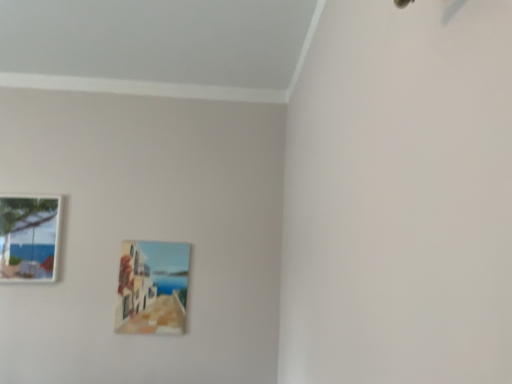
The image size is (512, 384). What do you see at coordinates (152, 287) in the screenshot?
I see `matte wooden picture frame at center, marked as the first picture frame in a right-to-left arrangement` at bounding box center [152, 287].

Measure the distance between matte wooden picture frame at center, marked as the first picture frame in a right-to-left arrangement, and camera.

The depth of matte wooden picture frame at center, marked as the first picture frame in a right-to-left arrangement, is 8.44 feet.

Measure the distance between point (142, 265) and camera.

2.62 meters.

In order to click on matte wooden picture frame at center, marked as the first picture frame in a right-to-left arrangement in this screenshot , I will do `click(152, 287)`.

Describe the element at coordinates (29, 237) in the screenshot. Image resolution: width=512 pixels, height=384 pixels. I see `wooden picture frame at lower left, the 1th picture frame when ordered from left to right` at that location.

How much space does wooden picture frame at lower left, the second picture frame when ordered from right to left, occupy vertically?

wooden picture frame at lower left, the second picture frame when ordered from right to left, is 21.69 inches in height.

Where is `wooden picture frame at lower left, the 1th picture frame when ordered from left to right`? The width and height of the screenshot is (512, 384). wooden picture frame at lower left, the 1th picture frame when ordered from left to right is located at coordinates (29, 237).

Locate an element on the screen. The height and width of the screenshot is (384, 512). matte wooden picture frame at center, which is the 2th picture frame from left to right is located at coordinates (152, 287).

Considering the relative positions of matte wooden picture frame at center, marked as the first picture frame in a right-to-left arrangement, and wooden picture frame at lower left, the 1th picture frame when ordered from left to right, in the image provided, is matte wooden picture frame at center, marked as the first picture frame in a right-to-left arrangement, to the right of wooden picture frame at lower left, the 1th picture frame when ordered from left to right, from the viewer's perspective?

Indeed, matte wooden picture frame at center, marked as the first picture frame in a right-to-left arrangement, is positioned on the right side of wooden picture frame at lower left, the 1th picture frame when ordered from left to right.

Based on the photo, considering the positions of objects matte wooden picture frame at center, which is the 2th picture frame from left to right, and wooden picture frame at lower left, the second picture frame when ordered from right to left, in the image provided, who is behind, matte wooden picture frame at center, which is the 2th picture frame from left to right, or wooden picture frame at lower left, the second picture frame when ordered from right to left,?

matte wooden picture frame at center, which is the 2th picture frame from left to right, is further from the camera.

Is point (158, 264) closer to viewer compared to point (3, 224)?

No, (158, 264) is behind (3, 224).

From the image's perspective, which object appears higher, matte wooden picture frame at center, which is the 2th picture frame from left to right, or wooden picture frame at lower left, the 1th picture frame when ordered from left to right?

From the image's view, wooden picture frame at lower left, the 1th picture frame when ordered from left to right, is above.

From a real-world perspective, does matte wooden picture frame at center, which is the 2th picture frame from left to right, sit lower than wooden picture frame at lower left, the 1th picture frame when ordered from left to right?

Yes, from a real-world perspective, matte wooden picture frame at center, which is the 2th picture frame from left to right, is below wooden picture frame at lower left, the 1th picture frame when ordered from left to right.

Based on the photo, is matte wooden picture frame at center, which is the 2th picture frame from left to right, wider or thinner than wooden picture frame at lower left, the second picture frame when ordered from right to left?

Considering their sizes, matte wooden picture frame at center, which is the 2th picture frame from left to right, looks slimmer than wooden picture frame at lower left, the second picture frame when ordered from right to left.

Considering the sizes of objects matte wooden picture frame at center, marked as the first picture frame in a right-to-left arrangement, and wooden picture frame at lower left, the second picture frame when ordered from right to left, in the image provided, who is shorter, matte wooden picture frame at center, marked as the first picture frame in a right-to-left arrangement, or wooden picture frame at lower left, the second picture frame when ordered from right to left,?

wooden picture frame at lower left, the second picture frame when ordered from right to left, is shorter.

From the picture: Considering the relative sizes of matte wooden picture frame at center, marked as the first picture frame in a right-to-left arrangement, and wooden picture frame at lower left, the second picture frame when ordered from right to left, in the image provided, is matte wooden picture frame at center, marked as the first picture frame in a right-to-left arrangement, bigger than wooden picture frame at lower left, the second picture frame when ordered from right to left,?

No, matte wooden picture frame at center, marked as the first picture frame in a right-to-left arrangement, is not bigger than wooden picture frame at lower left, the second picture frame when ordered from right to left.

Is matte wooden picture frame at center, which is the 2th picture frame from left to right, not within wooden picture frame at lower left, the 1th picture frame when ordered from left to right?

Indeed, matte wooden picture frame at center, which is the 2th picture frame from left to right, is completely outside wooden picture frame at lower left, the 1th picture frame when ordered from left to right.

Does matte wooden picture frame at center, which is the 2th picture frame from left to right, touch wooden picture frame at lower left, the second picture frame when ordered from right to left?

No, matte wooden picture frame at center, which is the 2th picture frame from left to right, is not with wooden picture frame at lower left, the second picture frame when ordered from right to left.

Could you tell me if matte wooden picture frame at center, which is the 2th picture frame from left to right, is facing wooden picture frame at lower left, the 1th picture frame when ordered from left to right?

No, matte wooden picture frame at center, which is the 2th picture frame from left to right, is not oriented towards wooden picture frame at lower left, the 1th picture frame when ordered from left to right.

Can you tell me how much matte wooden picture frame at center, marked as the first picture frame in a right-to-left arrangement, and wooden picture frame at lower left, the 1th picture frame when ordered from left to right, differ in facing direction?

The facing directions of matte wooden picture frame at center, marked as the first picture frame in a right-to-left arrangement, and wooden picture frame at lower left, the 1th picture frame when ordered from left to right, are 0.00288 degrees apart.

Find the location of a particular element. This screenshot has height=384, width=512. picture frame behind the wooden picture frame at lower left, the second picture frame when ordered from right to left is located at coordinates (152, 287).

Does wooden picture frame at lower left, the second picture frame when ordered from right to left, appear on the right side of matte wooden picture frame at center, which is the 2th picture frame from left to right?

In fact, wooden picture frame at lower left, the second picture frame when ordered from right to left, is to the left of matte wooden picture frame at center, which is the 2th picture frame from left to right.

Considering their positions, is wooden picture frame at lower left, the 1th picture frame when ordered from left to right, located in front of or behind matte wooden picture frame at center, marked as the first picture frame in a right-to-left arrangement?

In the image, wooden picture frame at lower left, the 1th picture frame when ordered from left to right, appears in front of matte wooden picture frame at center, marked as the first picture frame in a right-to-left arrangement.

Which is in front, point (16, 272) or point (124, 306)?

The point (16, 272) is closer.

From the image's perspective, is wooden picture frame at lower left, the second picture frame when ordered from right to left, located above or below matte wooden picture frame at center, which is the 2th picture frame from left to right?

wooden picture frame at lower left, the second picture frame when ordered from right to left, is above matte wooden picture frame at center, which is the 2th picture frame from left to right.

From a real-world perspective, relative to matte wooden picture frame at center, which is the 2th picture frame from left to right, is wooden picture frame at lower left, the 1th picture frame when ordered from left to right, vertically above or below?

From a real-world perspective, wooden picture frame at lower left, the 1th picture frame when ordered from left to right, is physically above matte wooden picture frame at center, which is the 2th picture frame from left to right.

Between wooden picture frame at lower left, the second picture frame when ordered from right to left, and matte wooden picture frame at center, marked as the first picture frame in a right-to-left arrangement, which one has smaller width?

matte wooden picture frame at center, marked as the first picture frame in a right-to-left arrangement.

Which of these two, wooden picture frame at lower left, the second picture frame when ordered from right to left, or matte wooden picture frame at center, marked as the first picture frame in a right-to-left arrangement, stands shorter?

wooden picture frame at lower left, the second picture frame when ordered from right to left, is shorter.

Who is smaller, wooden picture frame at lower left, the 1th picture frame when ordered from left to right, or matte wooden picture frame at center, which is the 2th picture frame from left to right?

matte wooden picture frame at center, which is the 2th picture frame from left to right.

Can we say wooden picture frame at lower left, the 1th picture frame when ordered from left to right, lies outside matte wooden picture frame at center, which is the 2th picture frame from left to right?

Absolutely, wooden picture frame at lower left, the 1th picture frame when ordered from left to right, is external to matte wooden picture frame at center, which is the 2th picture frame from left to right.

Are wooden picture frame at lower left, the second picture frame when ordered from right to left, and matte wooden picture frame at center, which is the 2th picture frame from left to right, far apart?

No, wooden picture frame at lower left, the second picture frame when ordered from right to left, is not far away from matte wooden picture frame at center, which is the 2th picture frame from left to right.

Is wooden picture frame at lower left, the 1th picture frame when ordered from left to right, facing away from matte wooden picture frame at center, which is the 2th picture frame from left to right?

wooden picture frame at lower left, the 1th picture frame when ordered from left to right, is not turned away from matte wooden picture frame at center, which is the 2th picture frame from left to right.

Can you tell me how much wooden picture frame at lower left, the second picture frame when ordered from right to left, and matte wooden picture frame at center, marked as the first picture frame in a right-to-left arrangement, differ in facing direction?

The angle between the facing direction of wooden picture frame at lower left, the second picture frame when ordered from right to left, and the facing direction of matte wooden picture frame at center, marked as the first picture frame in a right-to-left arrangement, is 0.00288 degrees.

You are a GUI agent. You are given a task and a screenshot of the screen. Output one action in this format:
    pyautogui.click(x=<x>, y=<y>)
    Task: Click on the picture frame that is on the right side of wooden picture frame at lower left, the 1th picture frame when ordered from left to right
    The image size is (512, 384).
    Given the screenshot: What is the action you would take?
    pyautogui.click(x=152, y=287)

In the image, there is a matte wooden picture frame at center, marked as the first picture frame in a right-to-left arrangement. At what (x,y) coordinates should I click in order to perform the action: click on picture frame above it (from the image's perspective). Please return your answer as a coordinate pair (x, y). Looking at the image, I should click on (29, 237).

Find the location of `picture frame that is under the wooden picture frame at lower left, the second picture frame when ordered from right to left (from a real-world perspective)`. picture frame that is under the wooden picture frame at lower left, the second picture frame when ordered from right to left (from a real-world perspective) is located at coordinates (152, 287).